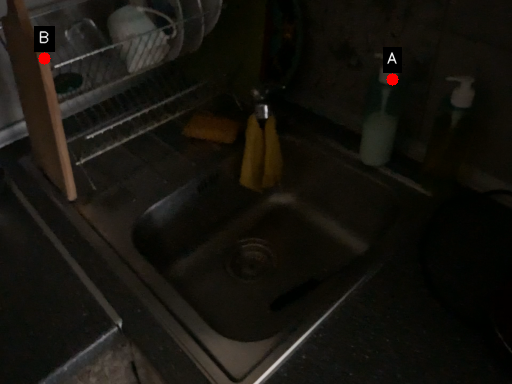
Question: Two points are circled on the image, labeled by A and B beside each circle. Which point is closer to the camera?

Choices:
 (A) A is closer
 (B) B is closer

Answer: (B)